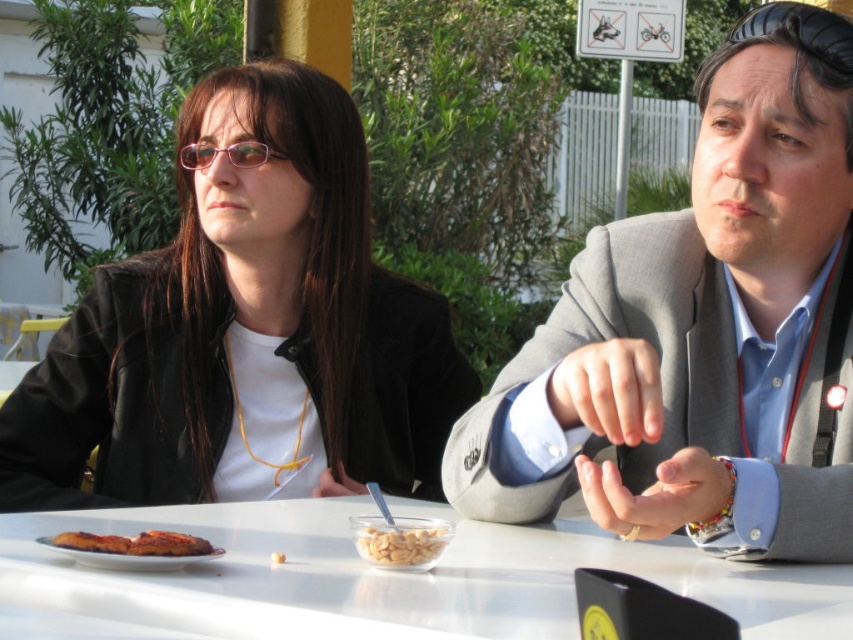
Can you confirm if white matte cereal bowl at center is positioned to the right of golden crispy pizza at lower left?

Correct, you'll find white matte cereal bowl at center to the right of golden crispy pizza at lower left.

Does white matte cereal bowl at center appear on the left side of golden crispy pizza at lower left?

In fact, white matte cereal bowl at center is to the right of golden crispy pizza at lower left.

You are a GUI agent. You are given a task and a screenshot of the screen. Output one action in this format:
    pyautogui.click(x=<x>, y=<y>)
    Task: Click on the white matte cereal bowl at center
    
    Given the screenshot: What is the action you would take?
    pyautogui.click(x=399, y=541)

Where is `white matte cereal bowl at center`? white matte cereal bowl at center is located at coordinates (399, 541).

Looking at this image, can you confirm if matte black jacket at left is wider than golden crispy pizza at lower left?

Indeed, matte black jacket at left has a greater width compared to golden crispy pizza at lower left.

Can you confirm if matte black jacket at left is positioned to the left of golden crispy pizza at lower left?

Indeed, matte black jacket at left is positioned on the left side of golden crispy pizza at lower left.

You are a GUI agent. You are given a task and a screenshot of the screen. Output one action in this format:
    pyautogui.click(x=<x>, y=<y>)
    Task: Click on the matte black jacket at left
    
    Given the screenshot: What is the action you would take?
    click(244, 323)

From the picture: Is gray suit jacket at center wider than pink plastic glasses at upper center?

Indeed, gray suit jacket at center has a greater width compared to pink plastic glasses at upper center.

Is point (543, 440) behind point (189, 161)?

No, it is not.

Is point (807, 257) in front of point (196, 161)?

Yes, point (807, 257) is closer to viewer.

I want to click on gray suit jacket at center, so click(x=698, y=330).